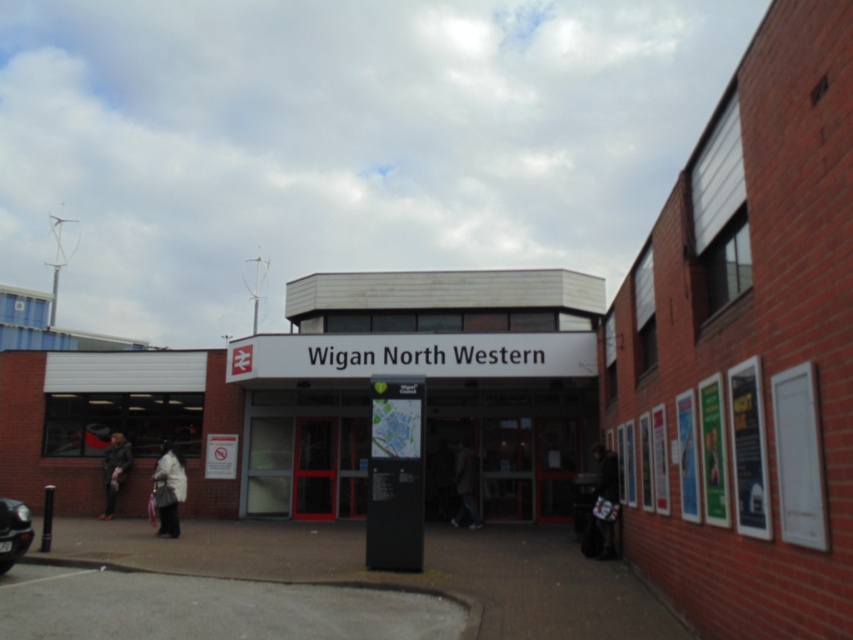
Question: Which of the following is the farthest from the observer?

Choices:
 (A) dark gray fabric coat at right
 (B) white fabric coat at lower left

Answer: (B)

Question: Is dark gray coat at lower left smaller than dark gray jacket at center?

Choices:
 (A) no
 (B) yes

Answer: (A)

Question: Which point appears farthest from the camera in this image?

Choices:
 (A) (115, 435)
 (B) (10, 516)
 (C) (457, 515)
 (D) (602, 492)

Answer: (A)

Question: Does white fabric coat at lower left have a larger size compared to dark gray coat at lower left?

Choices:
 (A) no
 (B) yes

Answer: (B)

Question: Which of the following is the farthest from the observer?

Choices:
 (A) red glass door at center
 (B) dark gray coat at lower left

Answer: (A)

Question: Does shiny black car at lower left have a smaller size compared to dark gray fabric coat at right?

Choices:
 (A) yes
 (B) no

Answer: (A)